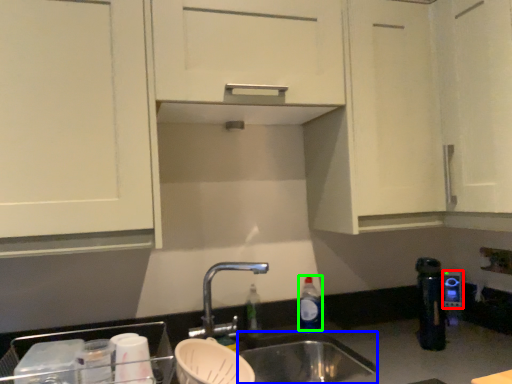
Question: Which object is positioned closest to appliance (highlighted by a red box)? Select from sink (highlighted by a blue box) and bottle (highlighted by a green box).

Choices:
 (A) sink
 (B) bottle

Answer: (B)